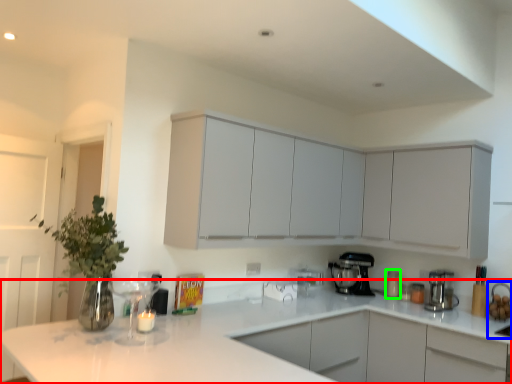
Question: Based on their relative distances, which object is farther from countertop (highlighted by a red box)? Choose from sink (highlighted by a blue box) and appliance (highlighted by a green box).

Choices:
 (A) sink
 (B) appliance

Answer: (B)